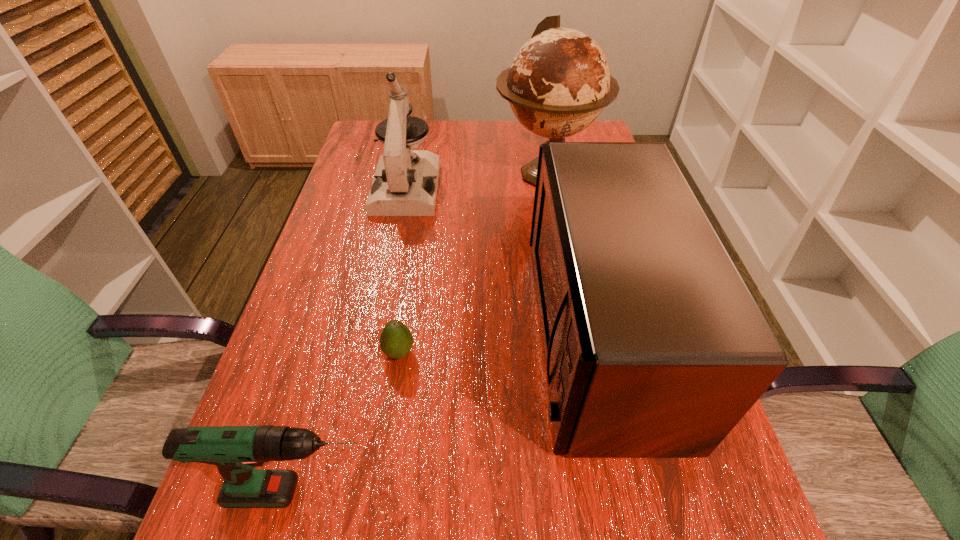
Find the location of a particular element. The width and height of the screenshot is (960, 540). vacant space located on the front-facing side of the microwave_oven is located at coordinates (384, 332).

Identify the location of free space located on the handle side of the second shortest object. (504, 492).

Locate an element on the screen. This screenshot has height=540, width=960. free spot located 0.120m on the back of the shortest object is located at coordinates (408, 294).

You are a GUI agent. You are given a task and a screenshot of the screen. Output one action in this format:
    pyautogui.click(x=<x>, y=<y>)
    Task: Click on the object present at the far edge
    
    Given the screenshot: What is the action you would take?
    pyautogui.click(x=559, y=82)

I want to click on microscope that is positioned at the left edge, so click(x=405, y=183).

Locate an element on the screen. The image size is (960, 540). drill that is positioned at the left edge is located at coordinates (236, 450).

Identify the location of globe present at the right edge. (559, 82).

Find the location of a particular element. microwave_oven that is at the right edge is located at coordinates (654, 347).

Locate an element on the screen. Image resolution: width=960 pixels, height=540 pixels. object that is at the far right corner is located at coordinates (559, 82).

Where is `vacant space at the far edge of the desktop`? Image resolution: width=960 pixels, height=540 pixels. vacant space at the far edge of the desktop is located at coordinates (513, 136).